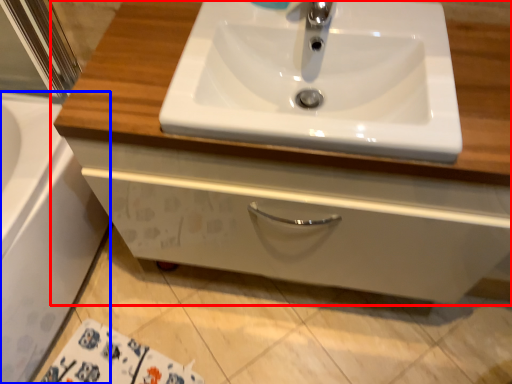
Question: Which of the following is the closest to the observer, bathroom cabinet (highlighted by a red box) or bath (highlighted by a blue box)?

Choices:
 (A) bathroom cabinet
 (B) bath

Answer: (A)